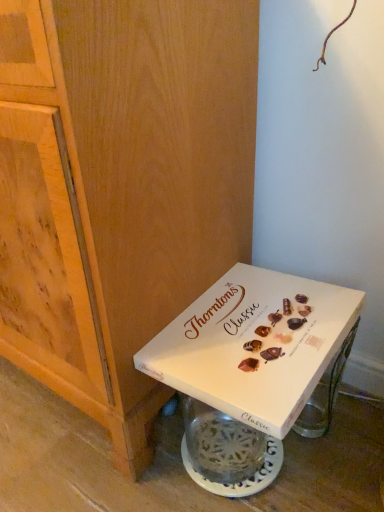
Question: Considering their positions, is wooden cabinet at lower left located in front of or behind white cardboard box at lower right?

Choices:
 (A) front
 (B) behind

Answer: (A)

Question: Do you think wooden cabinet at lower left is within white cardboard box at lower right, or outside of it?

Choices:
 (A) outside
 (B) inside

Answer: (A)

Question: In terms of height, does wooden cabinet at lower left look taller or shorter compared to white cardboard box at lower right?

Choices:
 (A) tall
 (B) short

Answer: (A)

Question: From a real-world perspective, is white cardboard box at lower right positioned above or below wooden cabinet at lower left?

Choices:
 (A) below
 (B) above

Answer: (A)

Question: Considering the positions of white cardboard box at lower right and wooden cabinet at lower left in the image, is white cardboard box at lower right wider or thinner than wooden cabinet at lower left?

Choices:
 (A) thin
 (B) wide

Answer: (A)

Question: Do you think white cardboard box at lower right is within wooden cabinet at lower left, or outside of it?

Choices:
 (A) outside
 (B) inside

Answer: (A)

Question: Considering their positions, is white cardboard box at lower right located in front of or behind wooden cabinet at lower left?

Choices:
 (A) behind
 (B) front

Answer: (A)